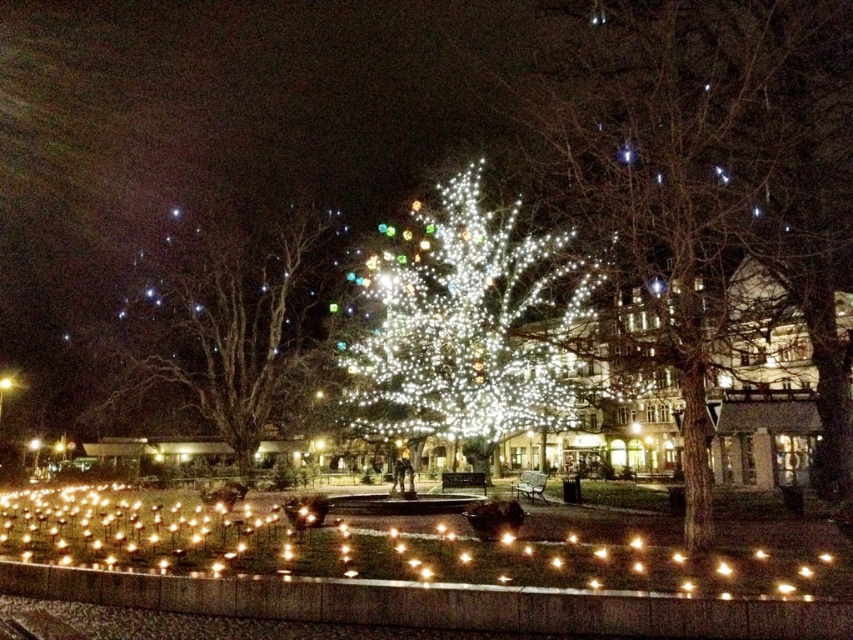
Question: Can you confirm if illuminated white lights at center is thinner than illuminated glass christmas tree at center?

Choices:
 (A) no
 (B) yes

Answer: (A)

Question: Which of the following is the farthest from the observer?

Choices:
 (A) (495, 410)
 (B) (630, 16)

Answer: (A)

Question: Which of the following is the farthest from the observer?

Choices:
 (A) (505, 321)
 (B) (601, 170)
 (C) (300, 225)

Answer: (C)

Question: Which of the following is the farthest from the observer?

Choices:
 (A) (366, 420)
 (B) (762, 35)

Answer: (A)

Question: Does illuminated white lights at center appear under illuminated wireframe tree at left?

Choices:
 (A) no
 (B) yes

Answer: (A)

Question: Does illuminated white lights at center appear over illuminated wireframe tree at left?

Choices:
 (A) no
 (B) yes

Answer: (B)